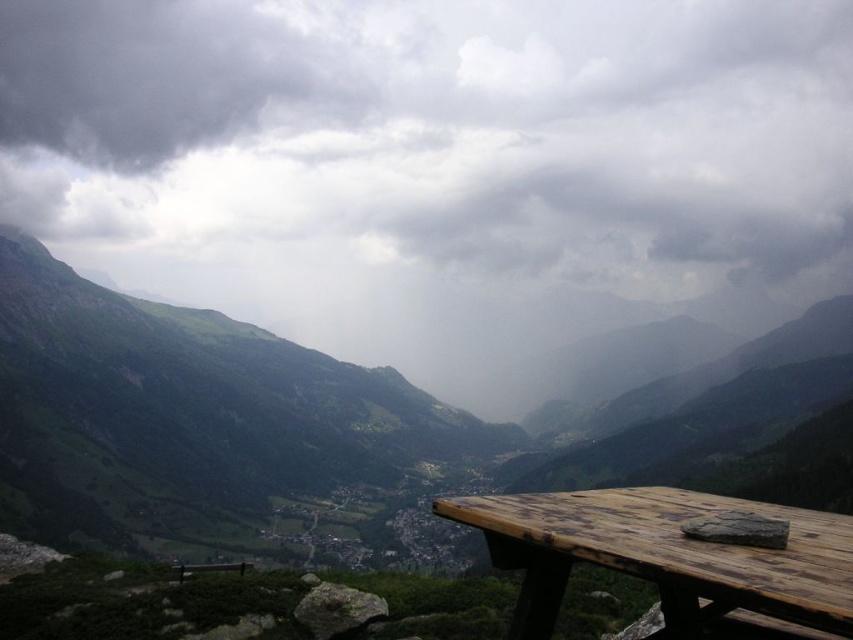
You are planning to take a photo of the cloudy sky at upper center and the wooden table at lower right. Which object would you need to focus on first if you want both to be in sharp focus?

The cloudy sky at upper center is wider than the wooden table at lower right, so you should focus on the cloudy sky at upper center first to ensure both are in sharp focus.

You are standing at the viewpoint and want to move from the wooden table at lower right to the brown wooden bench at lower center. Which direction should you walk to reach the bench?

You should walk to the left to reach the brown wooden bench at lower center because the wooden table at lower right is to the right of the brown wooden bench at lower center.

You are planning to set up a photography station at the viewpoint. You have a large camera setup that requires a surface area of at least 2 meters by 1 meter. Given the wooden table at lower right and the brown wooden bench at lower center, which object can accommodate your equipment?

The wooden table at lower right is larger in size than the brown wooden bench at lower center, so the wooden table at lower right can accommodate the equipment.